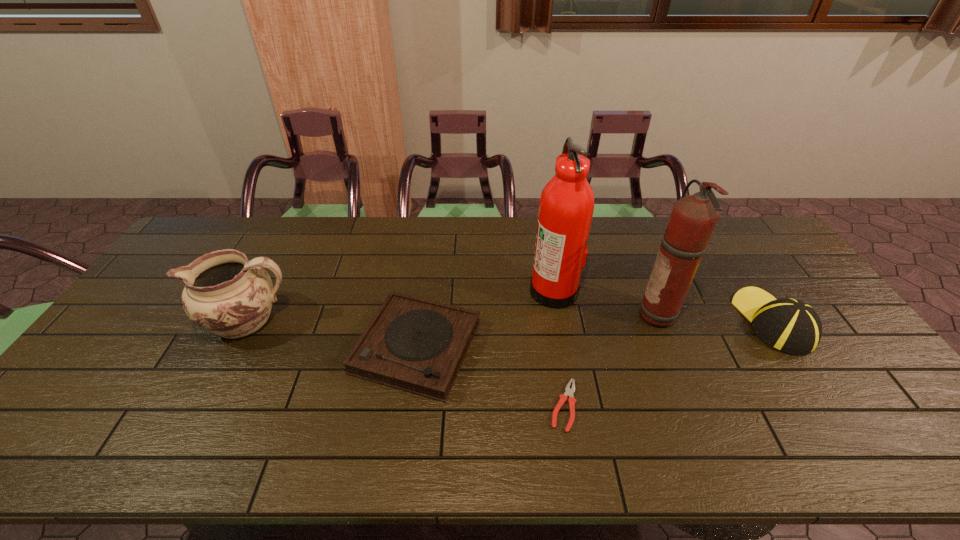
Where is `blank space that satisfies the following two spatial constraints: 1. on the spout of the pliers; 2. on the left side of the leftmost object`? The image size is (960, 540). blank space that satisfies the following two spatial constraints: 1. on the spout of the pliers; 2. on the left side of the leftmost object is located at coordinates (204, 406).

This screenshot has height=540, width=960. I want to click on free point that satisfies the following two spatial constraints: 1. on the side of the right fire extinguisher with the label and nozzle; 2. on the front side of the shortest object, so click(x=698, y=406).